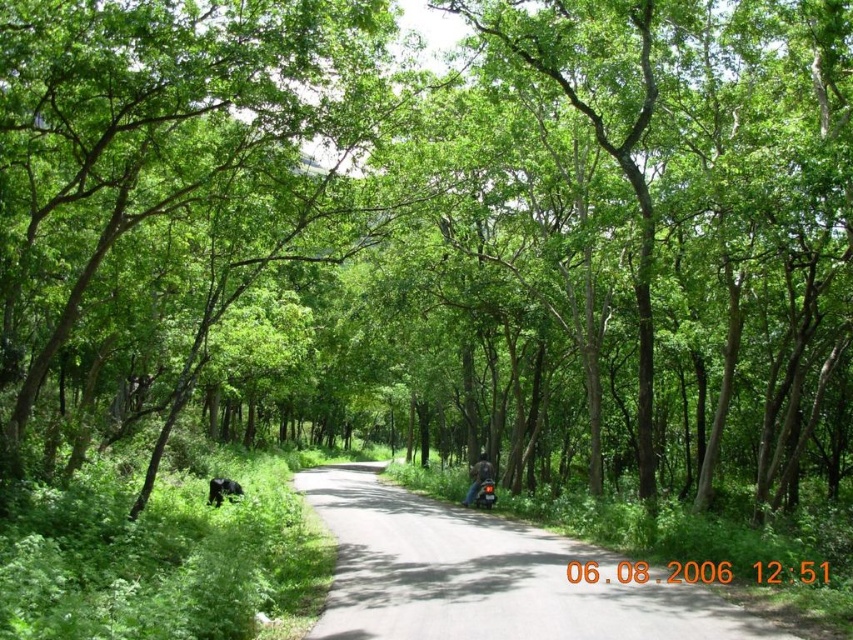
Question: Is asphalt road at center thinner than shiny black motorcycle at center?

Choices:
 (A) yes
 (B) no

Answer: (B)

Question: Does asphalt road at center appear over shiny black motorcycle at center?

Choices:
 (A) no
 (B) yes

Answer: (B)

Question: Is leather jacket at center to the right of shiny black motorcycle at center from the viewer's perspective?

Choices:
 (A) yes
 (B) no

Answer: (B)

Question: Estimate the real-world distances between objects in this image. Which object is closer to the asphalt road at center?

Choices:
 (A) leather jacket at center
 (B) shiny black motorcycle at center

Answer: (B)

Question: Which object is the farthest from the shiny black motorcycle at center?

Choices:
 (A) asphalt road at center
 (B) leather jacket at center

Answer: (A)

Question: Which of the following is the farthest from the observer?

Choices:
 (A) shiny black motorcycle at center
 (B) leather jacket at center

Answer: (B)